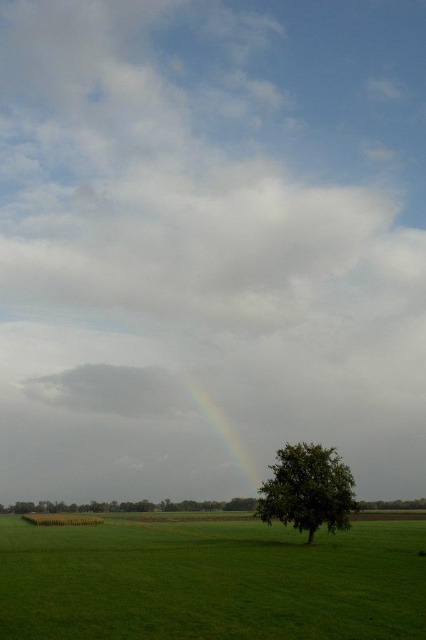
You are a photographer trying to capture the rainbow at center while ensuring the green leafy tree at lower right is visible in the frame. Given their heights, which object should you focus on first to ensure both are in the shot?

The green leafy tree at lower right is shorter than the rainbow at center, so you should focus on the rainbow at center first to ensure both are in the shot.

You are standing in the rural landscape and want to walk from the point at coordinates point [94,536] to the point at coordinates point [207,401]. Which direction should you face to walk towards the second point?

Since point [94,536] is in front of point [207,401], you should face towards the direction of the background to walk towards point [207,401].